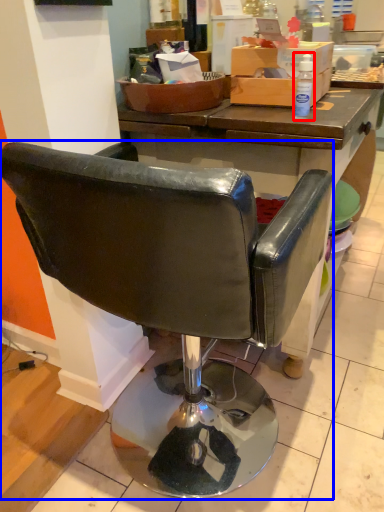
Question: Which point is closer to the camera, bottle (highlighted by a red box) or chair (highlighted by a blue box)?

Choices:
 (A) bottle
 (B) chair

Answer: (B)